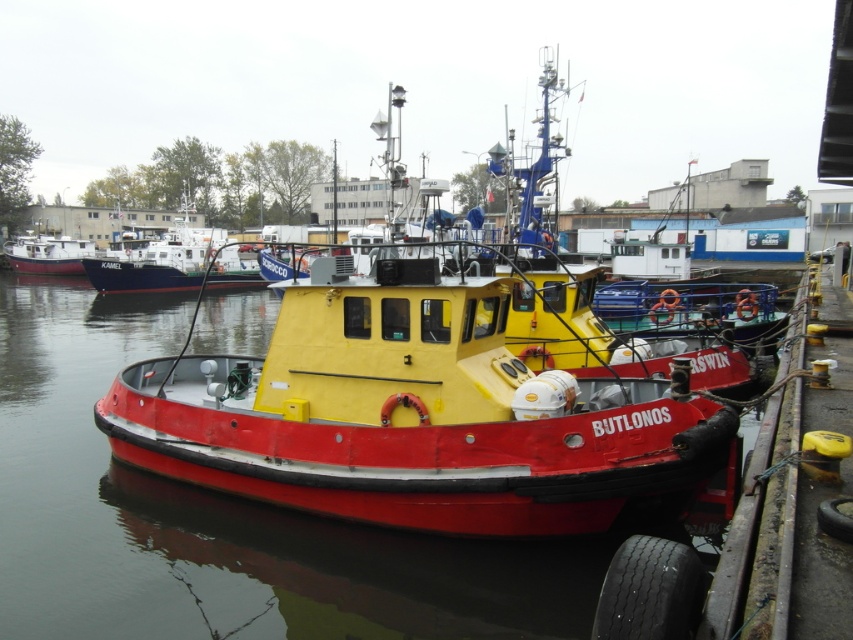
You are a photographer standing at the pier where the tugboat BUTLONOS is docked. You want to capture a photo that includes both the red matte water at center and the matte white boat at upper left. Which object will appear larger in your photo?

The red matte water at center will appear larger in the photo because it is closer to the viewer than the matte white boat at upper left.

You are navigating a small boat in the marina and need to pass between two points marked on your map as point (18, 349) and point (216, 259). Which point should you approach first to stay on course?

You should approach point (18, 349) first because it is in front of point (216, 259), so following this order will keep you on course.